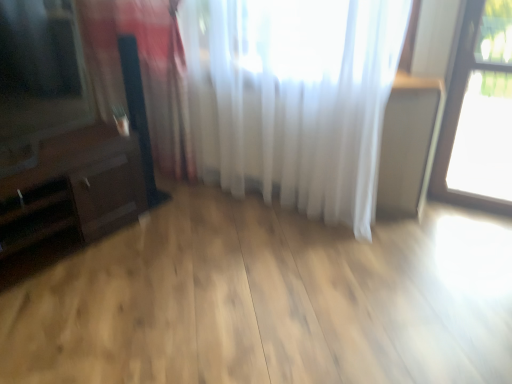
Identify the location of free area in between dark brown wood dresser at left and white sheer curtain at upper center, the 2th curtain in the left-to-right sequence. The height and width of the screenshot is (384, 512). (192, 240).